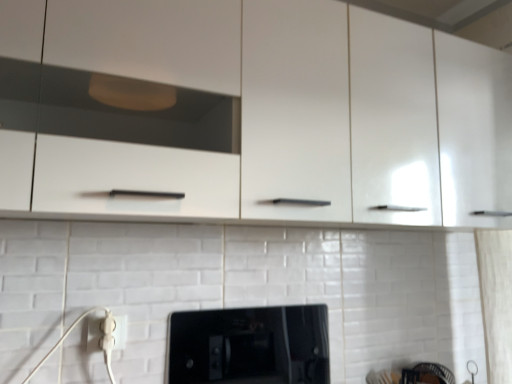
Question: From the image's perspective, is white plastic electric outlet at lower left positioned above or below black glossy microwave at center?

Choices:
 (A) below
 (B) above

Answer: (B)

Question: In the image, is white plastic electric outlet at lower left positioned in front of or behind black glossy microwave at center?

Choices:
 (A) behind
 (B) front

Answer: (B)

Question: Looking at their shapes, would you say white plastic electric outlet at lower left is wider or thinner than black glossy microwave at center?

Choices:
 (A) wide
 (B) thin

Answer: (B)

Question: From the image's perspective, relative to white plastic electric outlet at lower left, is black glossy microwave at center above or below?

Choices:
 (A) below
 (B) above

Answer: (A)

Question: Is black glossy microwave at center inside the boundaries of white plastic electric outlet at lower left, or outside?

Choices:
 (A) inside
 (B) outside

Answer: (B)

Question: Considering the positions of black glossy microwave at center and white plastic electric outlet at lower left in the image, is black glossy microwave at center wider or thinner than white plastic electric outlet at lower left?

Choices:
 (A) thin
 (B) wide

Answer: (B)

Question: From a real-world perspective, is black glossy microwave at center physically located above or below white plastic electric outlet at lower left?

Choices:
 (A) below
 (B) above

Answer: (A)